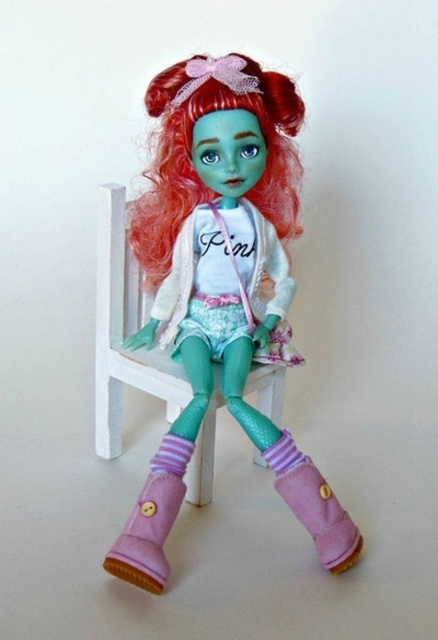
You are a photographer setting up a shoot for a doll. The doll is wearing a pink striped sock at lower center and sitting on a white wooden chair at center. To ensure the sock is visible in the final photo, where should you position the lighting?

The white wooden chair at center is positioned over the pink striped sock at lower center, so to ensure the sock is visible, you should position the lighting in a way that casts a shadow or highlights the area beneath the chair where the sock is located.

You are a toy designer who needs to package the doll for shipping. The packaging box has a divider that must be placed exactly between the shiny red hair at center and the matte pink boots at center. What is the minimum width of the divider required to fit between them?

The minimum width of the divider required is 2.50 inches, as the distance between the shiny red hair at center and the matte pink boots at center is exactly 2.50 inches.

What is the color of the dress at the point specified by the coordinates (176, 284)?

The point at coordinates (176, 284) is on the matte white dress at center, so the color is white.